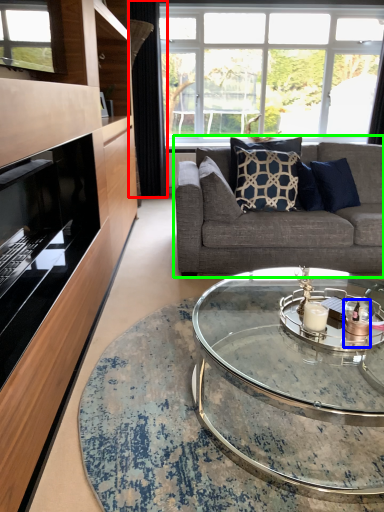
Question: Which is nearer to the curtain (highlighted by a red box)? candle holder (highlighted by a blue box) or studio couch (highlighted by a green box).

Choices:
 (A) candle holder
 (B) studio couch

Answer: (B)